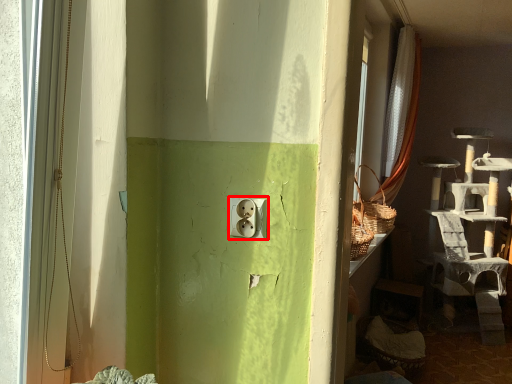
Question: In this image, where is electric outlet (annotated by the red box) located relative to curtain?

Choices:
 (A) right
 (B) left

Answer: (B)